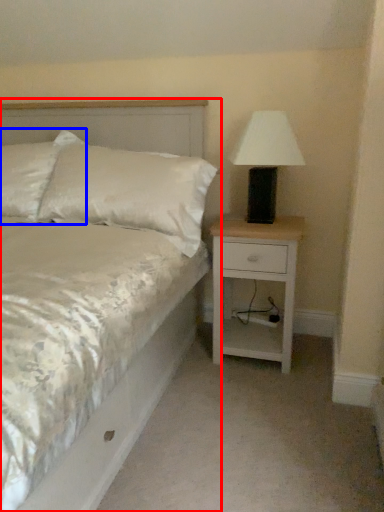
Question: Which point is closer to the camera, bed (highlighted by a red box) or pillow (highlighted by a blue box)?

Choices:
 (A) bed
 (B) pillow

Answer: (A)